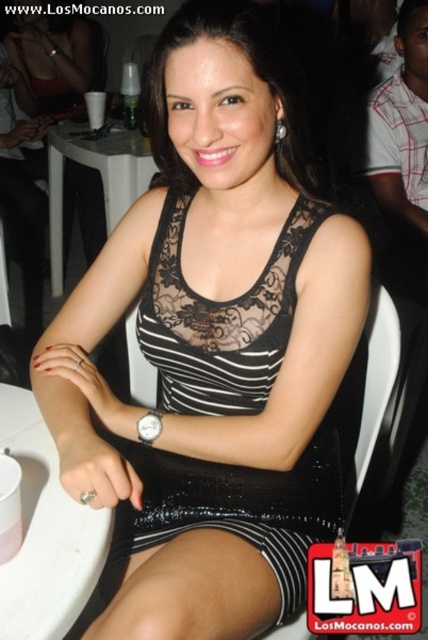
Question: Observing the image, what is the correct spatial positioning of black sequined dress at center in reference to white plastic table at lower left?

Choices:
 (A) below
 (B) above

Answer: (B)

Question: Which of the following is the closest to the observer?

Choices:
 (A) black sequined dress at center
 (B) white plastic table at lower left
 (C) white plastic table at center

Answer: (B)

Question: Is white plastic table at lower left wider than white plastic table at center?

Choices:
 (A) no
 (B) yes

Answer: (A)

Question: Which object is farther from the camera taking this photo?

Choices:
 (A) white plastic table at center
 (B) black sequined dress at center

Answer: (A)

Question: Is black sequined dress at center positioned behind white plastic table at center?

Choices:
 (A) no
 (B) yes

Answer: (A)

Question: Which of the following is the closest to the observer?

Choices:
 (A) black sequined dress at center
 (B) white plastic table at center
 (C) white plastic table at lower left

Answer: (C)